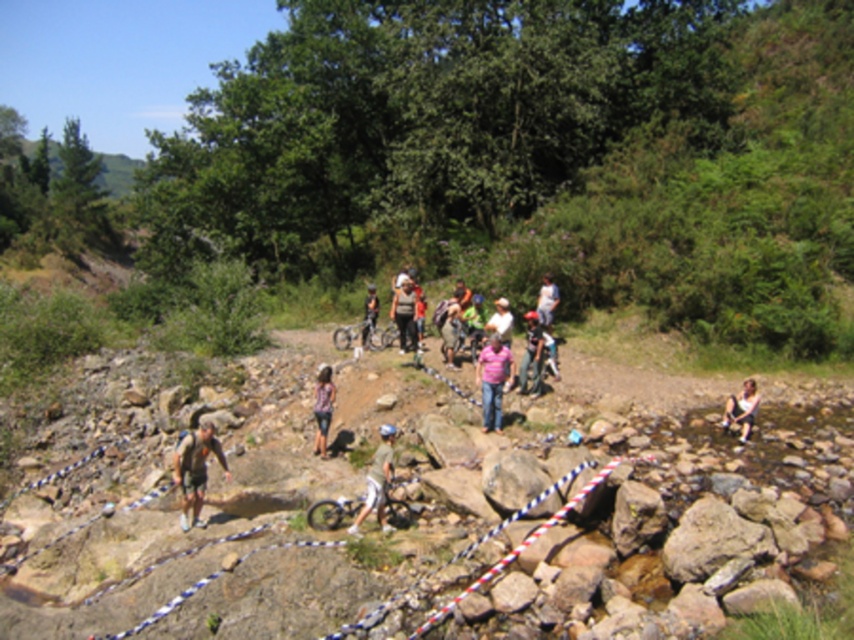
Question: Does white fabric shirt at lower right come behind matte black mountain bike at center?

Choices:
 (A) yes
 (B) no

Answer: (B)

Question: Can you confirm if camouflage fabric mountain biker at lower left is wider than pink cotton shirt at center?

Choices:
 (A) no
 (B) yes

Answer: (B)

Question: Is camouflage fabric mountain biker at lower left behind light blue denim jeans at center?

Choices:
 (A) yes
 (B) no

Answer: (B)

Question: Among these points, which one is nearest to the camera?

Choices:
 (A) (554, 296)
 (B) (317, 406)
 (C) (346, 506)
 (D) (197, 445)

Answer: (C)

Question: Which object appears farthest from the camera in this image?

Choices:
 (A) white fabric shirt at lower right
 (B) camouflage fabric mountain biker at lower left

Answer: (A)

Question: Which is nearer to the white fabric shirt at lower right?

Choices:
 (A) denim shorts at center
 (B) white matte shirt at center

Answer: (B)